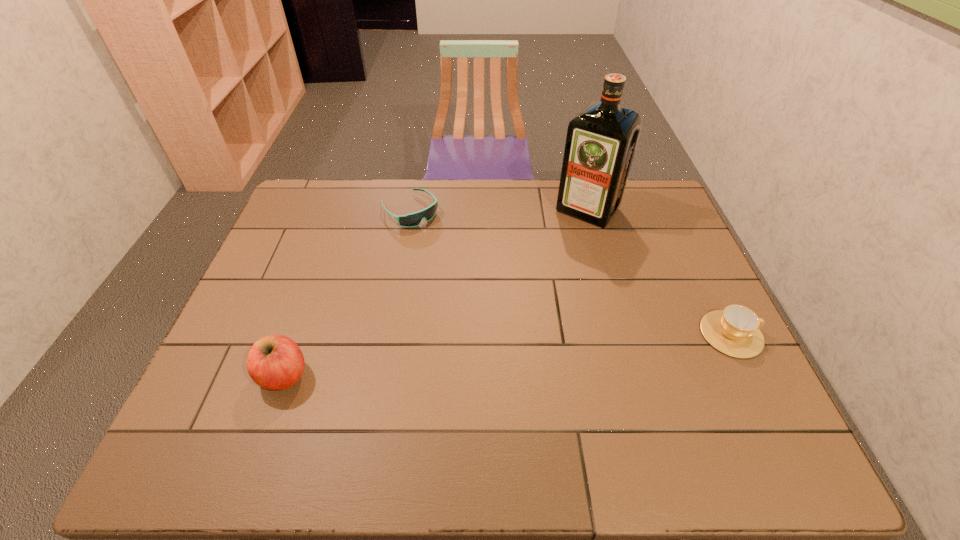
At what (x,y) coordinates should I click in order to perform the action: click on free point located on the front label of the second object from right to left. Please return your answer as a coordinate pair (x, y). This screenshot has height=540, width=960. Looking at the image, I should click on (539, 270).

Where is `vacant space located 0.060m on the front-facing side of the shortest object`? vacant space located 0.060m on the front-facing side of the shortest object is located at coordinates (435, 235).

Locate an element on the screen. free space located 0.200m on the front-facing side of the shortest object is located at coordinates (459, 260).

The image size is (960, 540). I want to click on vacant region located 0.050m on the front-facing side of the shortest object, so [x=433, y=233].

The height and width of the screenshot is (540, 960). I want to click on liquor that is at the far edge, so click(601, 140).

Identify the location of sunglasses that is at the far edge. Image resolution: width=960 pixels, height=540 pixels. (414, 219).

Locate an element on the screen. object located in the near edge section of the desktop is located at coordinates (275, 362).

This screenshot has width=960, height=540. In order to click on object at the left edge in this screenshot , I will do `click(275, 362)`.

Locate an element on the screen. The height and width of the screenshot is (540, 960). object situated at the right edge is located at coordinates (735, 331).

This screenshot has width=960, height=540. I want to click on object that is at the near left corner, so click(275, 362).